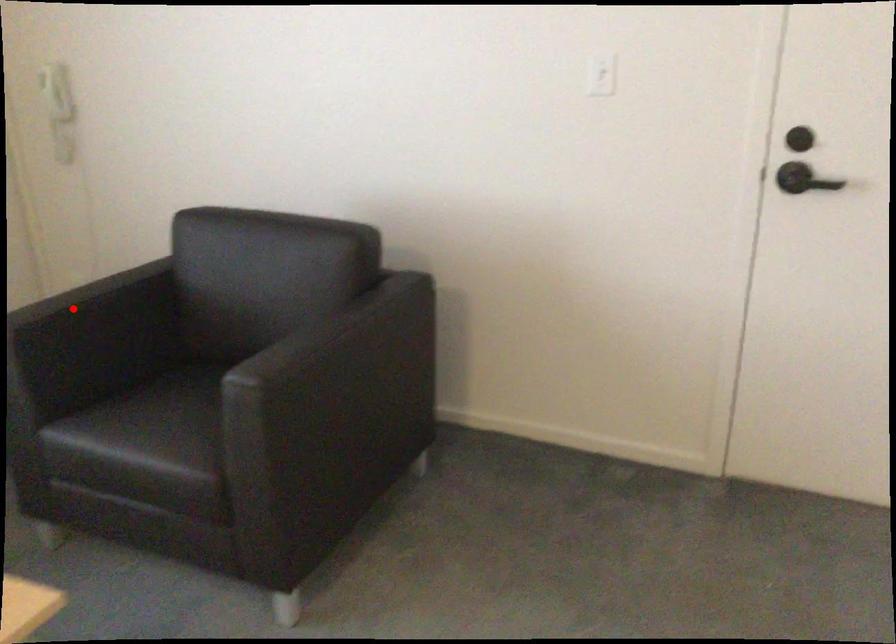
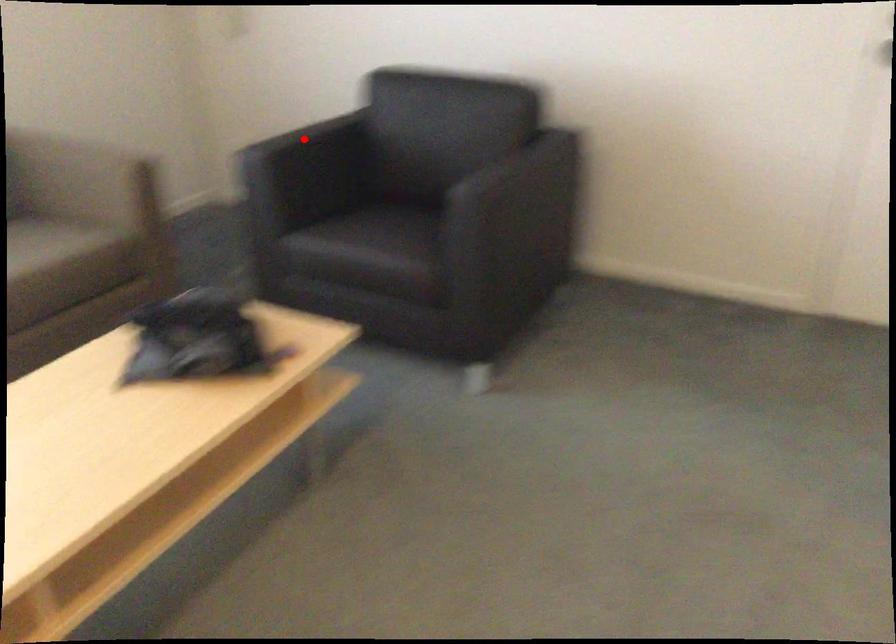
I am providing you with two images of the same scene from different viewpoints. A red point is marked on the first image and another point is marked on the second image. Does the point marked in image1 correspond to the same location as the one in image2?

Yes